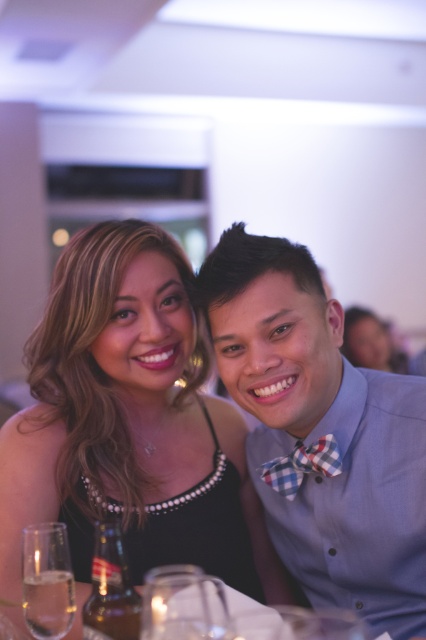
You are a photographer adjusting the camera focus. You need to ensure both the pearl necklace at center and the blue checkered bow tie at right are in focus. Given their heights, which object should you focus on first to ensure proper depth of field?

The pearl necklace at center is taller than the blue checkered bow tie at right. To ensure proper depth of field, focus on the taller object first, so focus on the pearl necklace at center first.

You are a photographer adjusting your camera settings to capture the pearl necklace at center and the blue checkered bow tie at right. Which object should you focus on first to ensure both are in sharp focus?

The pearl necklace at center is closer to the viewer than the blue checkered bow tie at right. To ensure both are in sharp focus, you should focus on the pearl necklace at center first, as it is the closer object.

You are a photographer taking a picture of the pearl necklace at center. You want to focus on the point at coordinate point (131, 422). Is this point on the pearl necklace at center?

Yes, the point (131, 422) is on the pearl necklace at center.